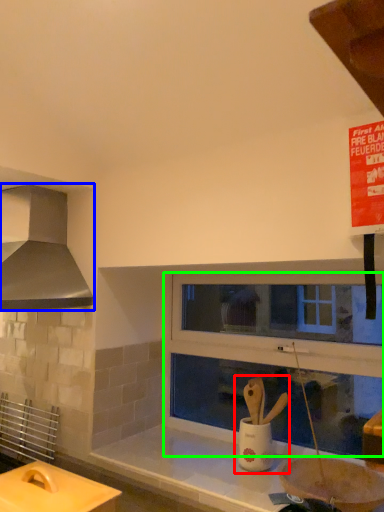
Question: Based on their relative distances, which object is farther from sink (highlighted by a red box)? Choose from kitchen appliance (highlighted by a blue box) and window frame (highlighted by a green box).

Choices:
 (A) kitchen appliance
 (B) window frame

Answer: (A)